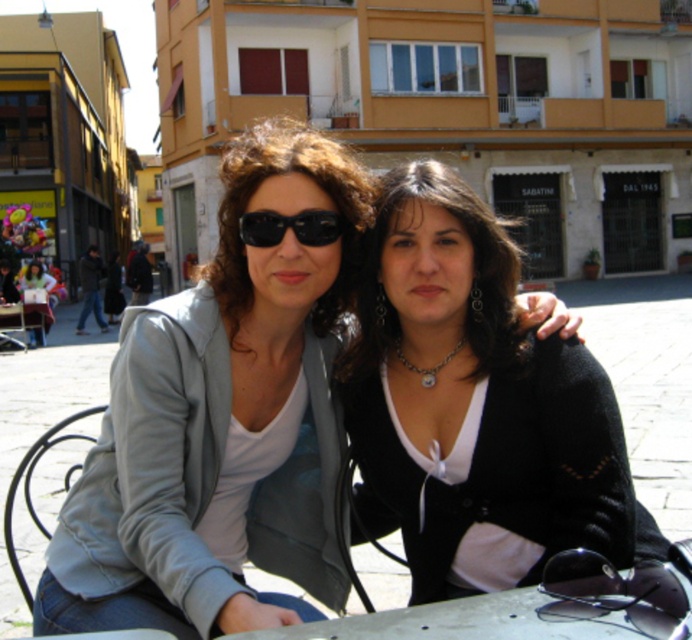
You are a tailor who needs to determine which item requires more fabric between the black matte sweater at center and the black plastic sunglasses at upper center. Which item would need more fabric?

The black matte sweater at center requires more fabric than the black plastic sunglasses at upper center because it is bigger in size.

You are a photographer trying to capture a closeup shot of the black plastic sunglasses at upper center without including the matte gray jacket at center in the frame. Is this possible given their positions?

The matte gray jacket at center has a greater height compared to the black plastic sunglasses at upper center. Therefore, it might block the view of the sunglasses if positioned directly in front, but since the jacket is at the center and the sunglasses are at upper center, adjusting the angle slightly downward could allow capturing the sunglasses without the jacket obstructing them.

You are taking a photo of the two people at the outdoor cafe table. You want to focus on the point closer to the camera. Which coordinate should you choose between point [576,612] and point [464,344]?

Point [576,612] is closer to the camera than point [464,344], so you should choose point [576,612] to focus on the closer point.